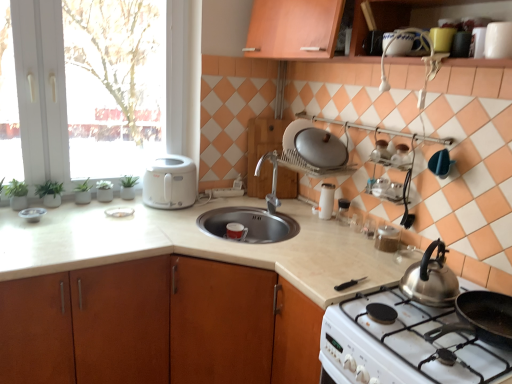
At what (x,y) coordinates should I click in order to perform the action: click on vacant space that's between green matte plant at left and white glossy plate at left, the second appliance positioned from the back. Please return your answer as a coordinate pair (x, y). The width and height of the screenshot is (512, 384). Looking at the image, I should click on (83, 206).